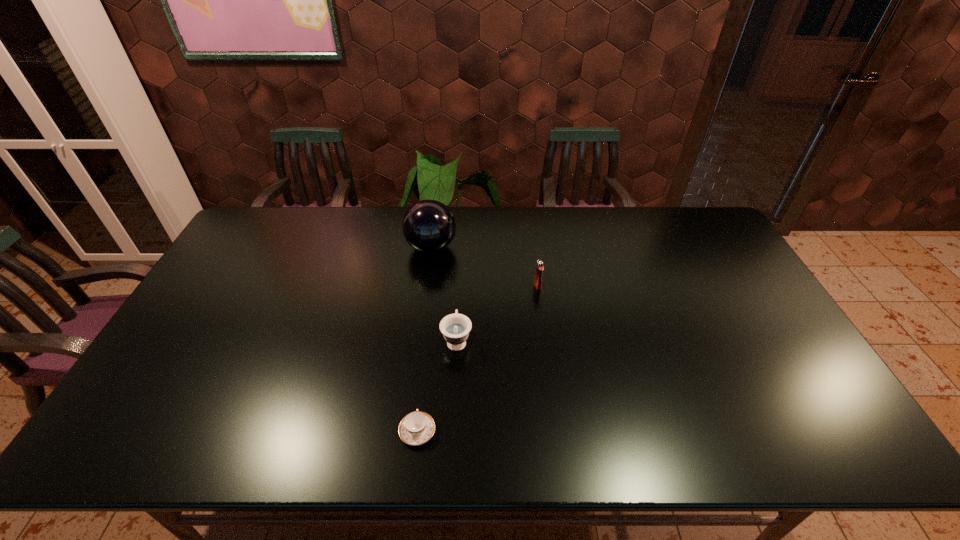
What are the coordinates of `free space between the farther teacup and the igniter` in the screenshot? It's located at (497, 313).

This screenshot has width=960, height=540. I want to click on vacant area that lies between the nearest object and the taller teacup, so click(x=437, y=386).

Where is `free spot between the taller teacup and the nearest object`? free spot between the taller teacup and the nearest object is located at coordinates (437, 386).

Point out which object is positioned as the second nearest to the taller teacup. Please provide its 2D coordinates. Your answer should be formatted as a tuple, i.e. [(x, y)], where the tuple contains the x and y coordinates of a point satisfying the conditions above.

[(540, 265)]

Image resolution: width=960 pixels, height=540 pixels. I want to click on the closest object to the shortest object, so click(x=455, y=328).

The width and height of the screenshot is (960, 540). Identify the location of vacant area that satisfies the following two spatial constraints: 1. on the side of the second farthest object with the finger holes; 2. on the left side of the tallest object. (426, 286).

You are a GUI agent. You are given a task and a screenshot of the screen. Output one action in this format:
    pyautogui.click(x=<x>, y=<y>)
    Task: Click on the free location that satisfies the following two spatial constraints: 1. on the side of the tallest object with the finger holes; 2. on the side of the taller teacup with the handle
    This screenshot has width=960, height=540.
    Given the screenshot: What is the action you would take?
    pyautogui.click(x=420, y=340)

The height and width of the screenshot is (540, 960). Find the location of `blank space that satisfies the following two spatial constraints: 1. on the side of the farthest object with the finger holes; 2. on the side with the handle of the shortest object`. blank space that satisfies the following two spatial constraints: 1. on the side of the farthest object with the finger holes; 2. on the side with the handle of the shortest object is located at coordinates (408, 431).

Identify the location of vacant space that satisfies the following two spatial constraints: 1. on the side of the farthest object with the finger holes; 2. on the side of the taller teacup with the handle. (420, 340).

Identify the location of vacant space that satisfies the following two spatial constraints: 1. on the side of the tallest object with the finger holes; 2. on the side with the handle of the nearer teacup. This screenshot has width=960, height=540. (408, 431).